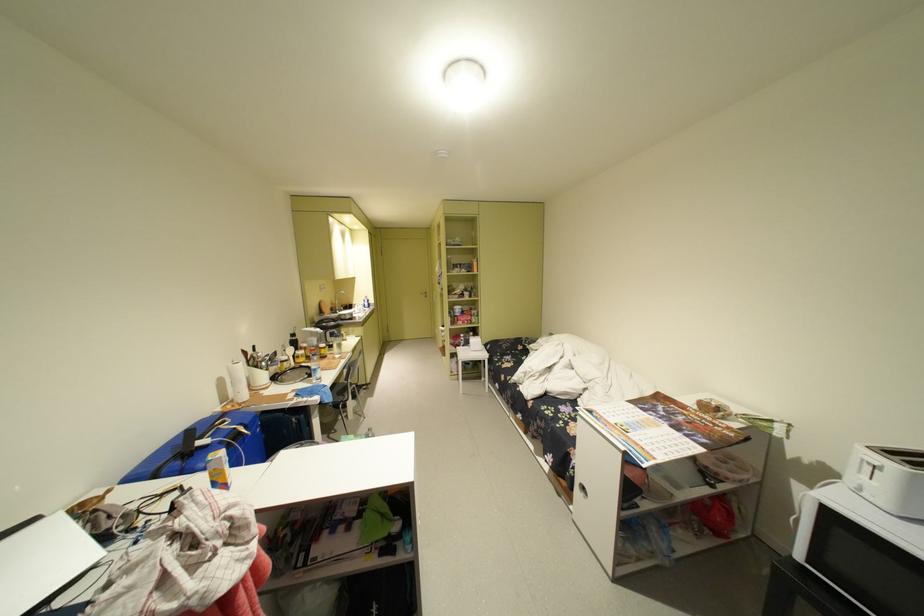
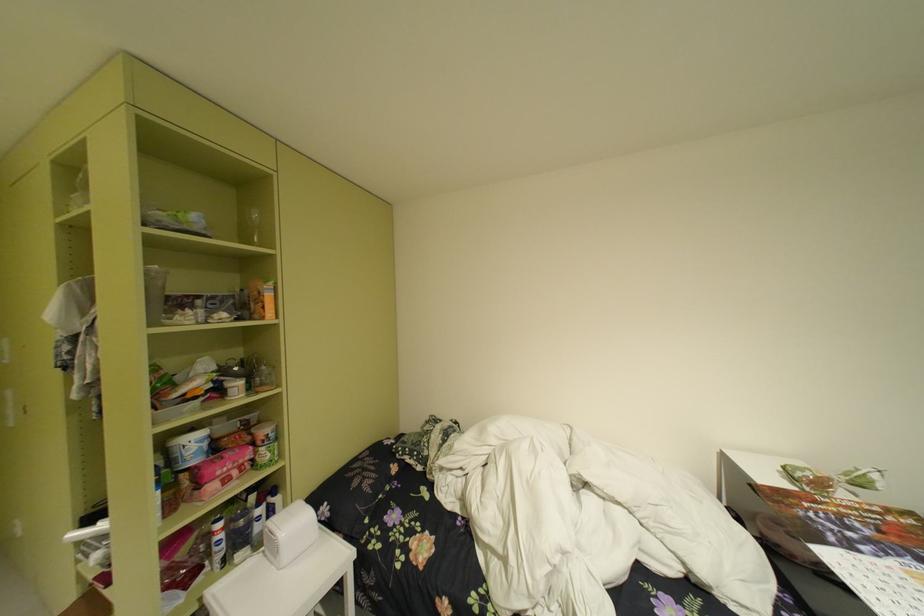
Where in the second image is the point corresponding to pixel 473 338 from the first image?

(235, 528)